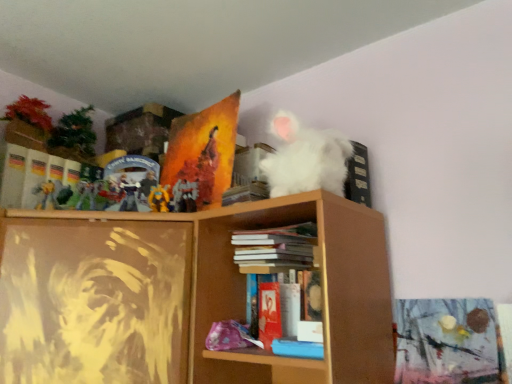
Question: From a real-world perspective, is hardcover book at center, the second book ordered from the bottom, physically located above or below matte red paperback book at center, the second paperback book from the back?

Choices:
 (A) below
 (B) above

Answer: (B)

Question: Considering the positions of point 250,233 and point 260,288, is point 250,233 closer or farther from the camera than point 260,288?

Choices:
 (A) farther
 (B) closer

Answer: (B)

Question: Which of these objects is positioned closest to the hardcover book at center, the 1th book from the top?

Choices:
 (A) blue matte book at lower center, the 1th book positioned from the bottom
 (B) metallic gold action figure at upper center
 (C) matte orange painting at upper center, placed as the second paperback book when sorted from bottom to top
 (D) matte red paperback book at center, marked as the first paperback book in a front-to-back arrangement

Answer: (D)

Question: Estimate the real-world distances between objects in this image. Which object is farther from the hardcover book at center, positioned as the 2th book in front-to-back order?

Choices:
 (A) blue matte book at lower center, the 1th book positioned from the bottom
 (B) matte orange painting at upper center, marked as the 1th paperback book in a top-to-bottom arrangement
 (C) metallic gold action figure at upper center
 (D) matte red paperback book at center, the 1th paperback book positioned from the bottom

Answer: (C)